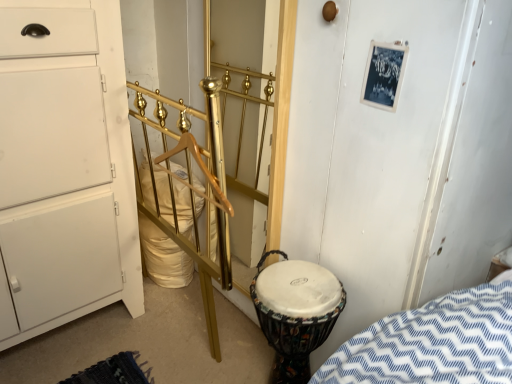
The height and width of the screenshot is (384, 512). In order to click on blank space above multicolored fabric drum at lower right (from a real-world perspective) in this screenshot , I will do `click(298, 280)`.